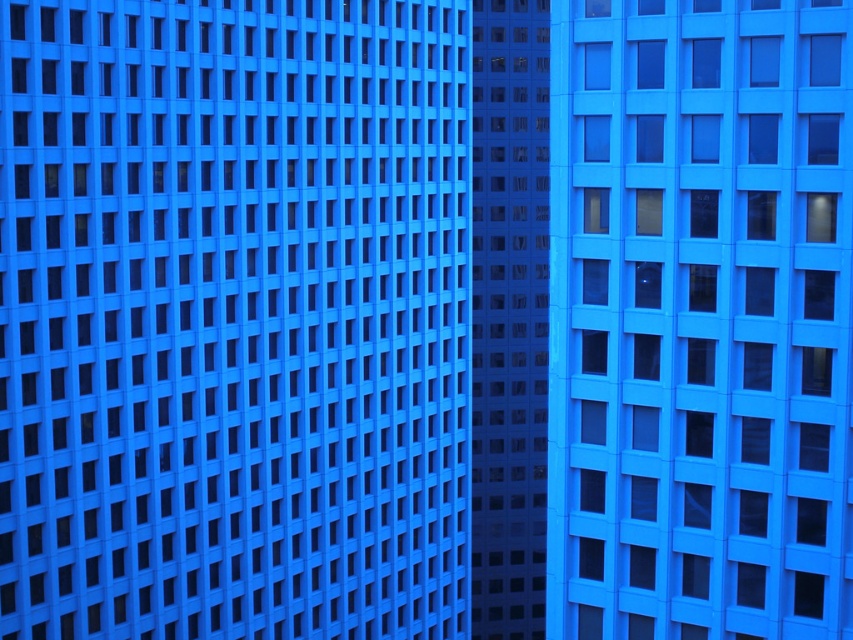
Does matte glass windows at right have a lesser height compared to transparent glass windows at center?

Yes.

Is matte glass windows at right positioned in front of transparent glass windows at center?

Yes, matte glass windows at right is in front of transparent glass windows at center.

Is point (592, 301) positioned before point (514, 470)?

That is True.

Find the location of `matte glass windows at right`. matte glass windows at right is located at coordinates (700, 320).